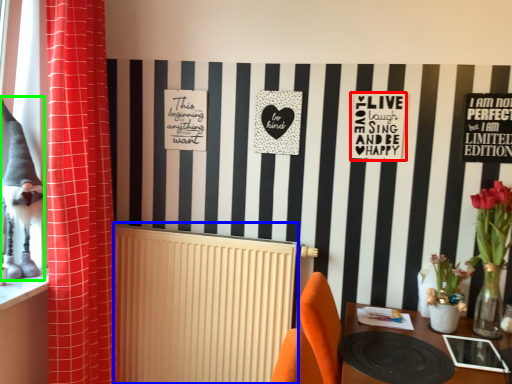
Question: Based on their relative distances, which object is farther from postcard (highlighted by a red box)? Choose from radiator (highlighted by a blue box) and animal (highlighted by a green box).

Choices:
 (A) radiator
 (B) animal

Answer: (B)